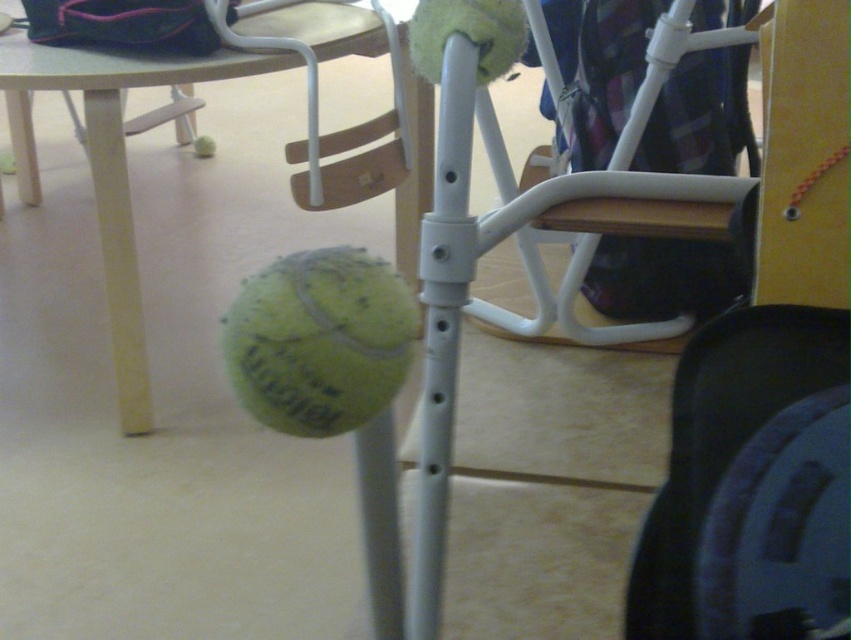
You are a tennis coach setting up equipment for a class. You need to retrieve the green matte tennis ball at center. Is it obstructed by the white plastic chair at center?

The green matte tennis ball at center is behind the white plastic chair at center, so it is obstructed by the chair and cannot be easily accessed without moving the chair.